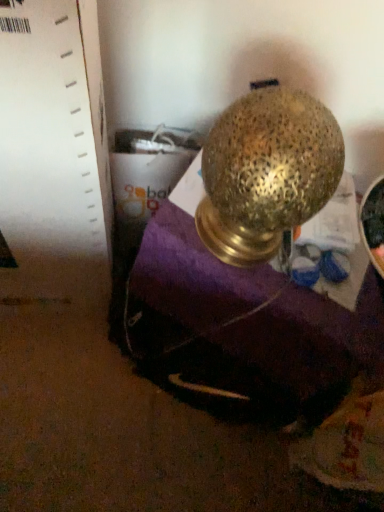
The image size is (384, 512). What do you see at coordinates (266, 172) in the screenshot?
I see `gold textured lamp at center` at bounding box center [266, 172].

Where is `gold textured lamp at center`? Image resolution: width=384 pixels, height=512 pixels. gold textured lamp at center is located at coordinates (266, 172).

Identify the location of gold textured lamp at center. Image resolution: width=384 pixels, height=512 pixels. (266, 172).